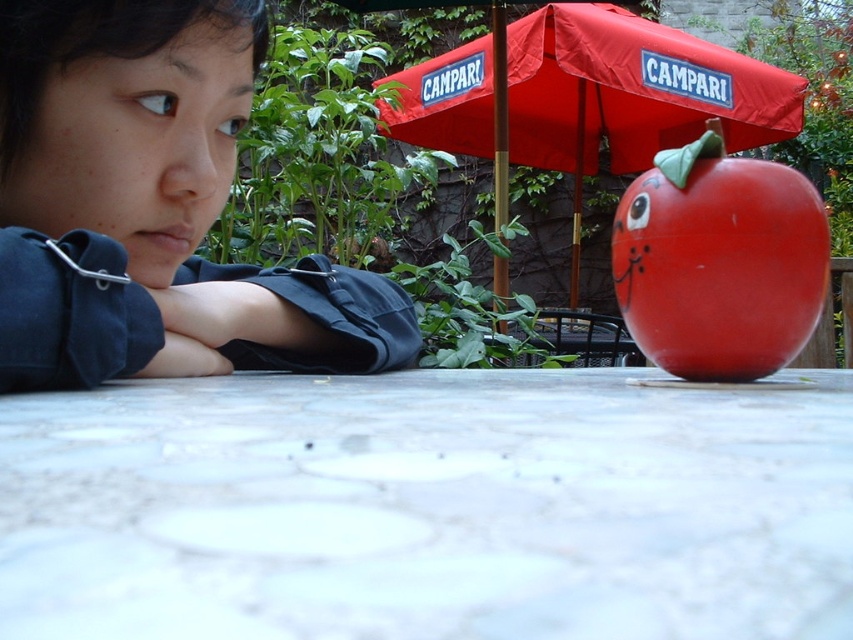
Question: Which point is farther to the camera?

Choices:
 (A) glossy plastic apple at center
 (B) red fabric umbrella at upper center
 (C) white marble table at lower center

Answer: (B)

Question: Among these points, which one is nearest to the camera?

Choices:
 (A) (639, 320)
 (B) (329, 264)
 (C) (674, 72)
 (D) (410, 540)

Answer: (D)

Question: Where is white marble table at lower center located in relation to red fabric umbrella at upper center in the image?

Choices:
 (A) below
 (B) above

Answer: (A)

Question: Among these objects, which one is farthest from the camera?

Choices:
 (A) white marble table at lower center
 (B) red fabric umbrella at upper center
 (C) glossy plastic apple at center
 (D) matte black shirt at lower left

Answer: (B)

Question: Can you confirm if red fabric umbrella at upper center is smaller than glossy plastic apple at center?

Choices:
 (A) yes
 (B) no

Answer: (B)

Question: Does white marble table at lower center appear on the right side of red fabric umbrella at upper center?

Choices:
 (A) yes
 (B) no

Answer: (B)